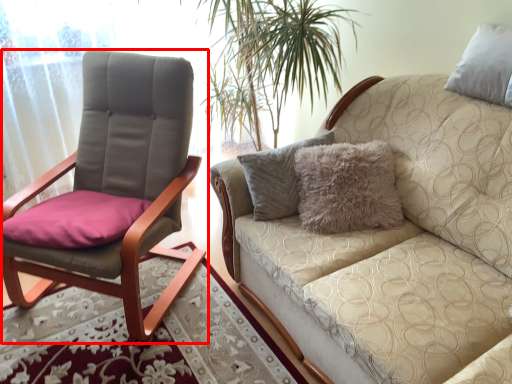
Question: From the image's perspective, what is the correct spatial relationship of chair (annotated by the red box) in relation to studio couch?

Choices:
 (A) below
 (B) above

Answer: (B)